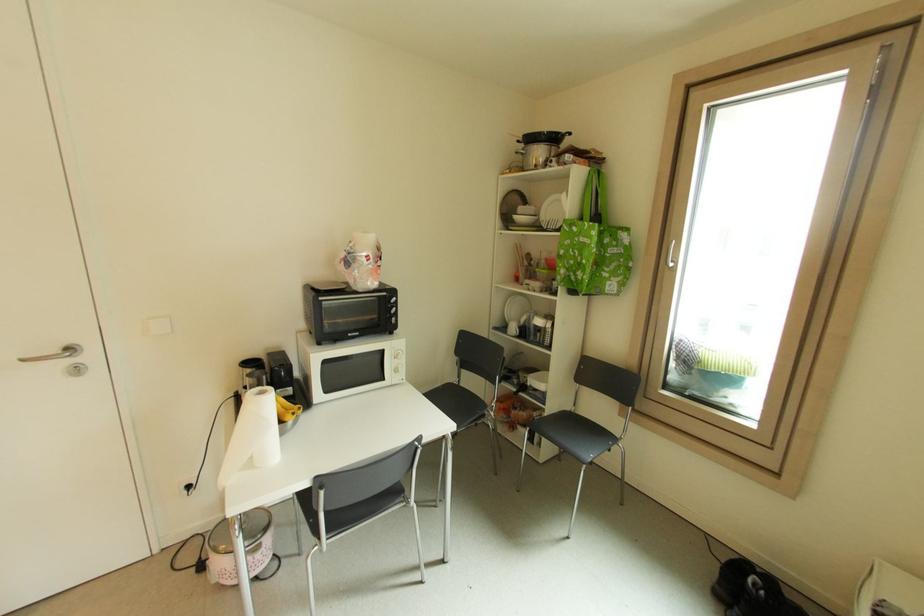
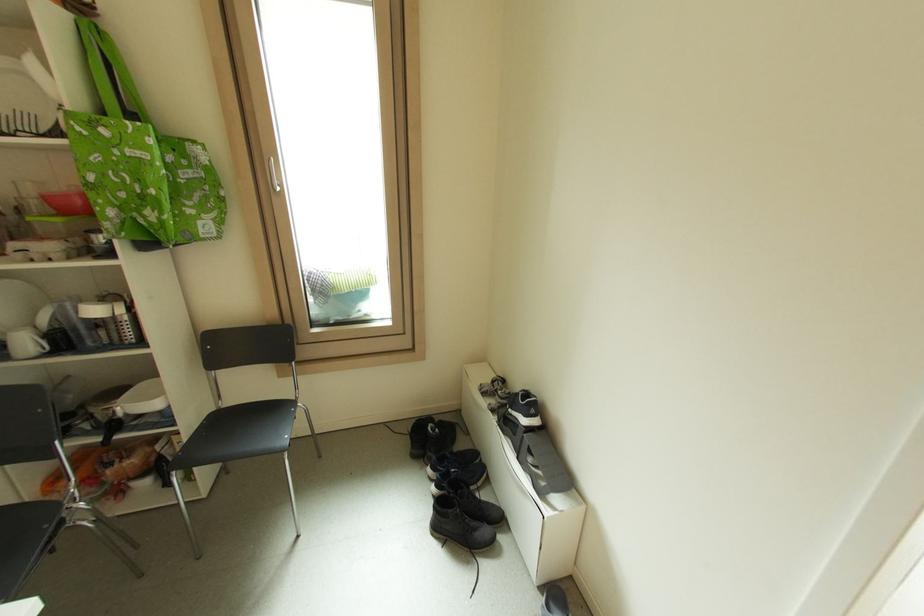
The first image is from the beginning of the video and the second image is from the end. How did the camera likely rotate when shooting the video?

The camera's rotation is toward right-down.